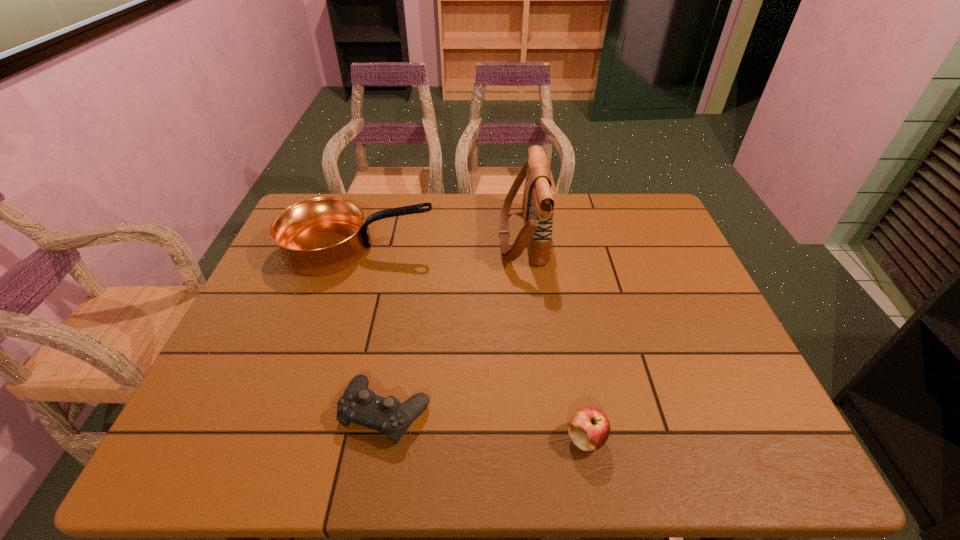
Image resolution: width=960 pixels, height=540 pixels. Find the location of `object that is the nearest to the tallest object`. object that is the nearest to the tallest object is located at coordinates (320, 236).

Identify the location of vacant region that satisfies the following two spatial constraints: 1. on the handle side of the frying pan; 2. on the left side of the apple. The image size is (960, 540). (299, 438).

Where is `free space in the image that satisfies the following two spatial constraints: 1. on the back side of the control; 2. on the handle side of the frying pan`? The height and width of the screenshot is (540, 960). free space in the image that satisfies the following two spatial constraints: 1. on the back side of the control; 2. on the handle side of the frying pan is located at coordinates (415, 248).

This screenshot has width=960, height=540. In order to click on blank space that satisfies the following two spatial constraints: 1. on the front side of the shortest object; 2. on the left side of the apple in this screenshot , I will do `click(382, 438)`.

You are a GUI agent. You are given a task and a screenshot of the screen. Output one action in this format:
    pyautogui.click(x=<x>, y=<y>)
    Task: Click on the vacant position in the image that satisfies the following two spatial constraints: 1. on the back side of the shortest object; 2. on the handle side of the frying pan
    
    Given the screenshot: What is the action you would take?
    pyautogui.click(x=415, y=248)

Identify the location of vacant area that satisfies the following two spatial constraints: 1. on the front side of the apple; 2. on the right side of the shortest object. Image resolution: width=960 pixels, height=540 pixels. (382, 438).

The height and width of the screenshot is (540, 960). What are the coordinates of `free space that satisfies the following two spatial constraints: 1. on the back side of the shortest object; 2. on the handle side of the third shortest object` in the screenshot? It's located at (415, 248).

The height and width of the screenshot is (540, 960). In order to click on free point that satisfies the following two spatial constraints: 1. on the handle side of the shortest object; 2. on the right side of the second tallest object in this screenshot , I will do `click(307, 411)`.

Find the location of a particular element. vacant space that satisfies the following two spatial constraints: 1. on the front-facing side of the apple; 2. on the right side of the shoulder bag is located at coordinates (544, 438).

Identify the location of blank space that satisfies the following two spatial constraints: 1. on the back side of the control; 2. on the handle side of the frying pan. The width and height of the screenshot is (960, 540). (415, 248).